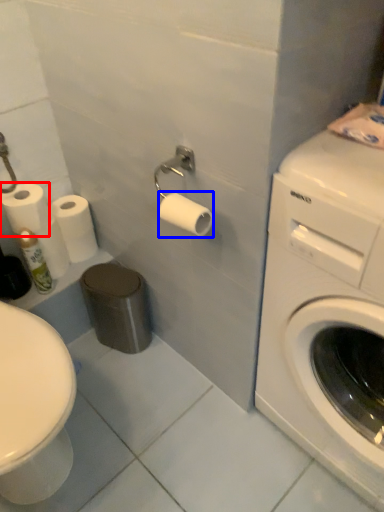
Question: Which object is further to the camera taking this photo, toilet paper (highlighted by a red box) or toilet paper (highlighted by a blue box)?

Choices:
 (A) toilet paper
 (B) toilet paper

Answer: (A)